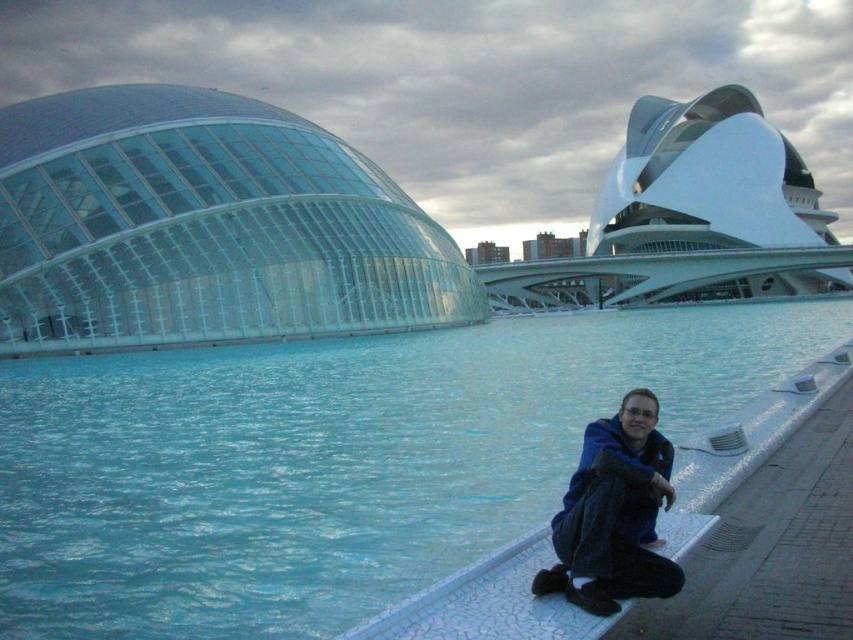
You are standing at the edge of the water in this futuristic scene. You see the blue glass water at center and the blue fleece jacket at lower right. Which object is taller when viewed from your position?

The blue glass water at center is taller than the blue fleece jacket at lower right.

You are a drone operator trying to capture a photo of the blue glass water at center from above. The drone can only fly up to 15 meters high. Can the drone safely take the photo without getting too close to the water?

The blue glass water at center is 17.69 meters from the camera. Since the drone can only fly up to 15 meters high, it cannot reach the required altitude to capture the photo from above without getting too close to the water.